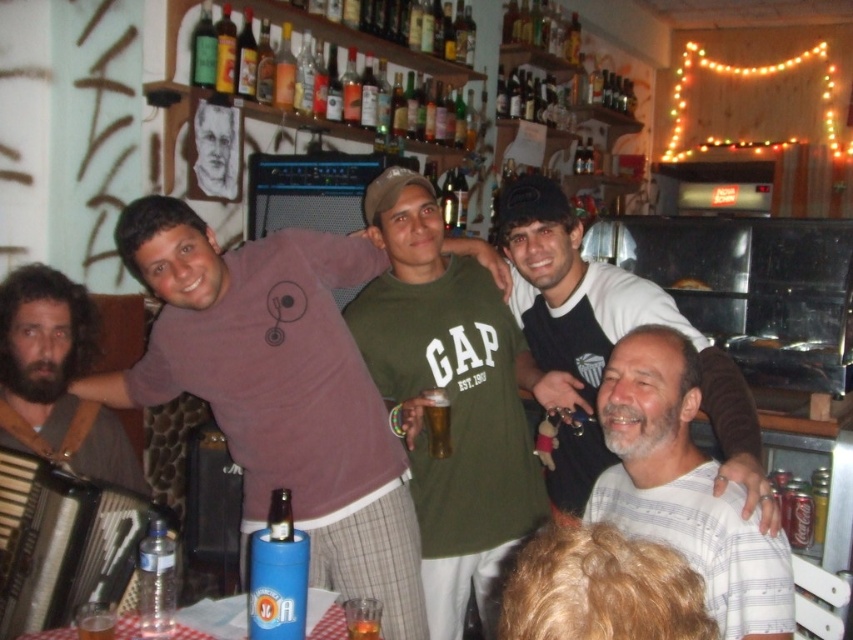
Is translucent glass beer at center smaller than translucent glass bottle at upper center?

Yes, translucent glass beer at center is smaller than translucent glass bottle at upper center.

Can you confirm if translucent glass beer at center is taller than translucent glass bottle at upper center?

Incorrect, translucent glass beer at center's height is not larger of translucent glass bottle at upper center's.

Is point (444, 445) in front of point (271, 100)?

That is True.

Locate an element on the screen. The height and width of the screenshot is (640, 853). translucent glass beer at center is located at coordinates (437, 420).

Looking at this image, does silver metallic accordion at lower left appear under green glass bottle at upper center?

Indeed, silver metallic accordion at lower left is positioned under green glass bottle at upper center.

Describe the element at coordinates (62, 541) in the screenshot. The width and height of the screenshot is (853, 640). I see `silver metallic accordion at lower left` at that location.

Which is in front, point (28, 579) or point (215, 70)?

Point (28, 579) is in front.

What are the coordinates of `silver metallic accordion at lower left` in the screenshot? It's located at (62, 541).

Is brown leather strap at left further to the viewer compared to clear plastic bottle at lower left?

Yes, brown leather strap at left is behind clear plastic bottle at lower left.

This screenshot has width=853, height=640. Identify the location of brown leather strap at left. (59, 461).

Find the location of a particular element. This screenshot has width=853, height=640. brown leather strap at left is located at coordinates (59, 461).